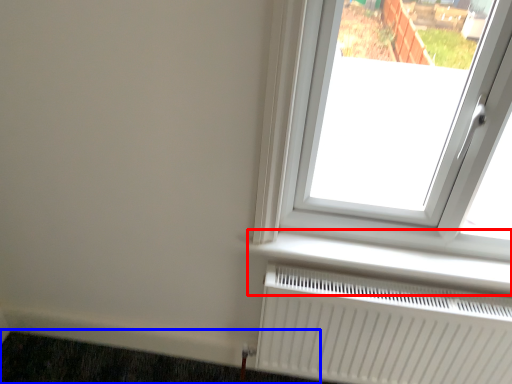
Question: Which point is further to the camera, window sill (highlighted by a red box) or doormat (highlighted by a blue box)?

Choices:
 (A) window sill
 (B) doormat

Answer: (B)